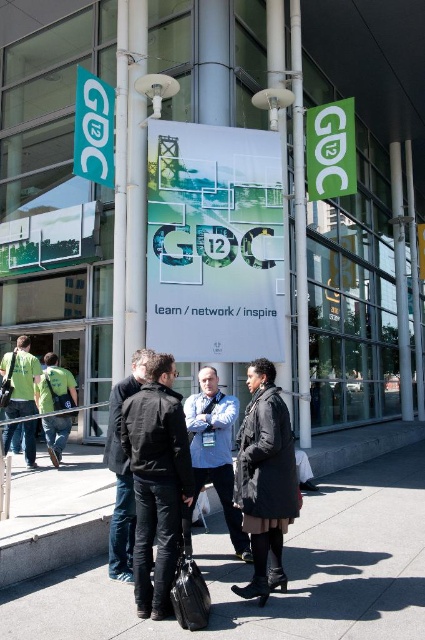
Is light blue shirt at center closer to the viewer compared to green plastic sign at upper left?

Yes.

Does light blue shirt at center appear over green plastic sign at upper left?

No.

Is point (204, 385) more distant than point (76, 124)?

No, it is in front of (76, 124).

Locate an element on the screen. light blue shirt at center is located at coordinates (215, 451).

Is black matte coat at center to the right of green matte sign at upper right from the viewer's perspective?

Incorrect, black matte coat at center is not on the right side of green matte sign at upper right.

Is black matte coat at center smaller than green matte sign at upper right?

Correct, black matte coat at center occupies less space than green matte sign at upper right.

The width and height of the screenshot is (425, 640). What do you see at coordinates (265, 480) in the screenshot?
I see `black matte coat at center` at bounding box center [265, 480].

Image resolution: width=425 pixels, height=640 pixels. I want to click on black matte coat at center, so click(265, 480).

Can you confirm if white paper sign at center is shorter than green fabric shirt at left?

No, white paper sign at center is not shorter than green fabric shirt at left.

Is white paper sign at center to the right of green fabric shirt at left from the viewer's perspective?

Correct, you'll find white paper sign at center to the right of green fabric shirt at left.

The height and width of the screenshot is (640, 425). Find the location of `white paper sign at center`. white paper sign at center is located at coordinates (215, 243).